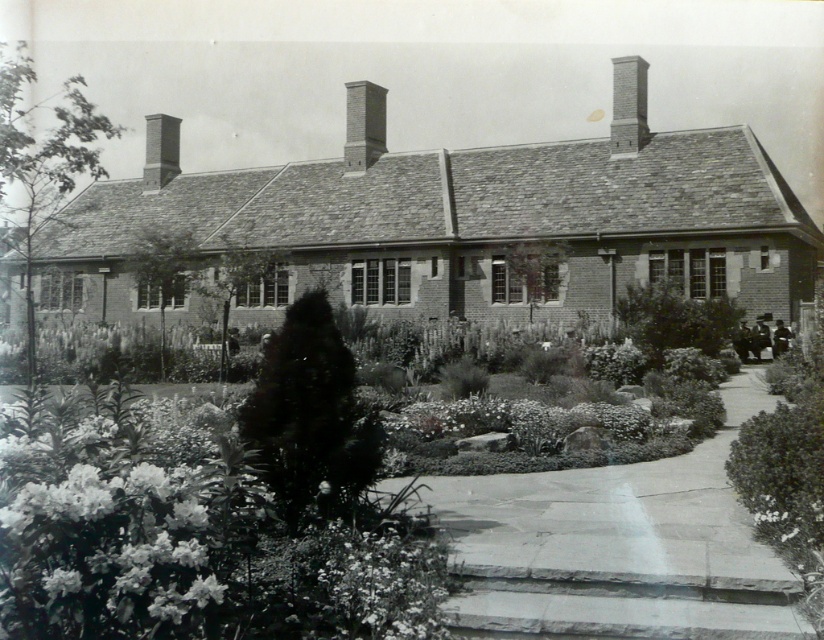
You are a gardener planning to trim the fluffy green shrubbery at center and the smooth brick chimney at upper right. Which object requires more attention to avoid damaging its structure?

The fluffy green shrubbery at center requires more attention because it is thinner than the smooth brick chimney at upper right, making it more delicate and prone to damage during trimming.

You are standing at the entrance of the building and want to know what is located at the coordinates point (307, 528) in the garden. What would you find there?

At point (307, 528), you would find fluffy green shrubbery at center.

You are standing at the entrance of the building and want to walk towards the point labeled as point (166, 150). Which direction should you go relative to the other point, point (116, 579)?

To reach point (166, 150) from the entrance, you should walk towards the direction opposite of point (116, 579) since point (116, 579) is behind point (166, 150).